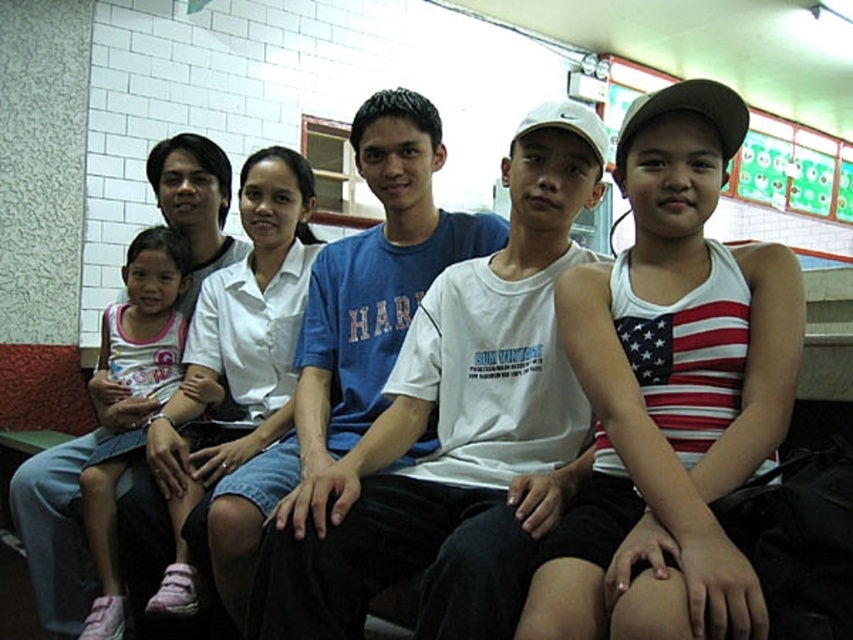
You are a photographer trying to capture a candid shot of the two individuals wearing white cotton tank top at center and white cotton shirt at center. Since you want to ensure both are fully visible in the frame, which one should you adjust your camera angle to focus on first to account for their size difference?

The white cotton tank top at center is wider than the white cotton shirt at center. To ensure both are fully visible, focus on the wider white cotton tank top at center first, then adjust the frame to include the narrower white cotton shirt at center.